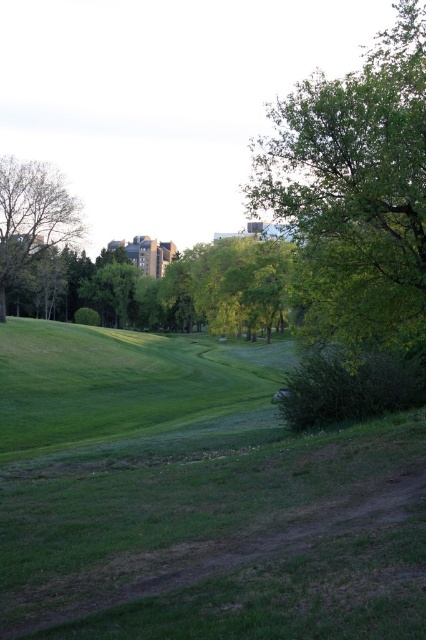
Question: Can you confirm if green leafy tree at upper right is positioned to the right of green leafy tree at left?

Choices:
 (A) yes
 (B) no

Answer: (A)

Question: Is green leafy tree at upper right to the left of green leafy tree at left from the viewer's perspective?

Choices:
 (A) no
 (B) yes

Answer: (A)

Question: Which point appears farthest from the camera in this image?

Choices:
 (A) (8, 198)
 (B) (313, 131)

Answer: (A)

Question: In this image, where is green leafy tree at upper right located relative to green leafy tree at left?

Choices:
 (A) left
 (B) right

Answer: (B)

Question: Which object appears farthest from the camera in this image?

Choices:
 (A) green leafy tree at upper right
 (B) green leafy tree at left

Answer: (B)